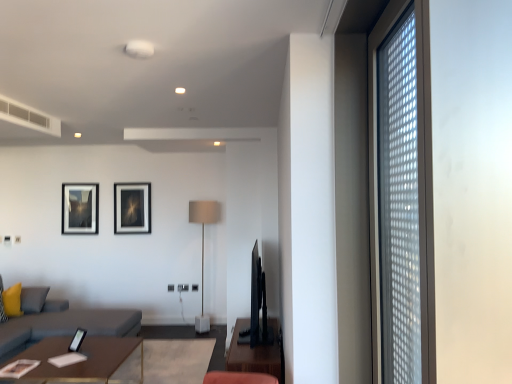
Question: Considering their positions, is matte black picture frame at upper left, the third picture frame viewed from the right, located in front of or behind wooden table at lower left, the 1th table when ordered from left to right?

Choices:
 (A) behind
 (B) front

Answer: (A)

Question: Is point (86, 198) closer or farther from the camera than point (10, 362)?

Choices:
 (A) closer
 (B) farther

Answer: (B)

Question: Which of these objects is positioned closest to the brown wooden table at center, positioned as the 2th table in left-to-right order?

Choices:
 (A) gray fabric couch at left
 (B) transparent glass window at right
 (C) matte black picture frame at lower center, the 3th picture frame from the left
 (D) wooden table at lower left, acting as the second table starting from the right
 (E) matte gray floor lamp at center

Answer: (D)

Question: Which object is the farthest from the wooden table at lower left, acting as the second table starting from the right?

Choices:
 (A) matte gray floor lamp at center
 (B) gray fabric couch at left
 (C) yellow fabric pillow at lower left
 (D) transparent glass window at right
 (E) matte black picture frame at upper left, which ranks as the third picture frame in front-to-back order

Answer: (D)